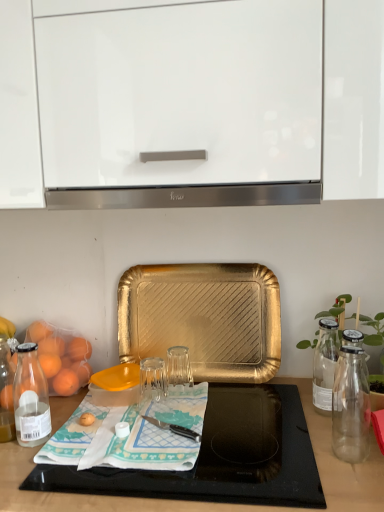
Locate an element on the screen. This screenshot has height=512, width=384. empty space that is ontop of gold textured tray at center (from a real-world perspective) is located at coordinates (205, 263).